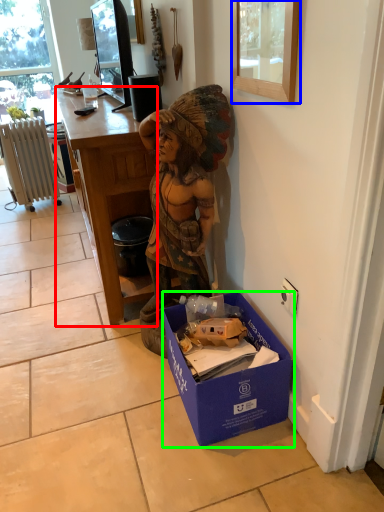
Question: Based on their relative distances, which object is nearer to desk (highlighted by a red box)? Choose from picture frame (highlighted by a blue box) and box (highlighted by a green box).

Choices:
 (A) picture frame
 (B) box

Answer: (B)